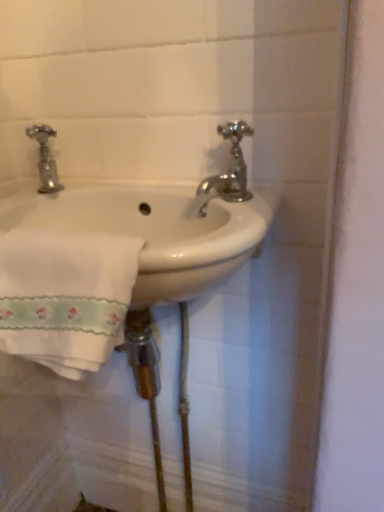
Identify the location of white embroidered towel at lower left. tap(65, 297).

What is the approximate height of white ceramic sink at center?

It is 14.19 centimeters.

Image resolution: width=384 pixels, height=512 pixels. Find the location of `polished chrome faucet at upper right`. polished chrome faucet at upper right is located at coordinates (231, 167).

Between polished chrome faucet at upper right and white embroidered towel at lower left, which one has smaller size?

polished chrome faucet at upper right is smaller.

Measure the distance from polished chrome faucet at upper right to white embroidered towel at lower left.

polished chrome faucet at upper right and white embroidered towel at lower left are 10.01 inches apart from each other.

Can you confirm if polished chrome faucet at upper right is thinner than white embroidered towel at lower left?

Indeed, polished chrome faucet at upper right has a lesser width compared to white embroidered towel at lower left.

The image size is (384, 512). I want to click on tap behind the white embroidered towel at lower left, so click(231, 167).

Which of these two, white embroidered towel at lower left or polished chrome faucet at upper right, is thinner?

polished chrome faucet at upper right is thinner.

Is polished chrome faucet at upper right located within white embroidered towel at lower left?

No, polished chrome faucet at upper right is located outside of white embroidered towel at lower left.

Based on the photo, are white embroidered towel at lower left and polished chrome faucet at upper right making contact?

No, white embroidered towel at lower left is not touching polished chrome faucet at upper right.

Is white embroidered towel at lower left to the right of polished chrome faucet at upper right from the viewer's perspective?

No, white embroidered towel at lower left is not to the right of polished chrome faucet at upper right.

Is polished chrome faucet at upper right far away from white ceramic sink at center?

polished chrome faucet at upper right is near white ceramic sink at center, not far away.

From the image's perspective, which one is positioned higher, polished chrome faucet at upper right or white ceramic sink at center?

polished chrome faucet at upper right.

Is polished chrome faucet at upper right closer to the viewer compared to white ceramic sink at center?

No, it is not.

Is white ceramic sink at center a part of polished chrome faucet at upper right?

No.

Is white embroidered towel at lower left thinner than white ceramic sink at center?

Correct, the width of white embroidered towel at lower left is less than that of white ceramic sink at center.

Would you say white embroidered towel at lower left is a long distance from white ceramic sink at center?

No.

Between point (79, 337) and point (133, 189), which one is positioned behind?

Positioned behind is point (133, 189).

Is point (159, 186) more distant than point (131, 243)?

Yes, point (159, 186) is behind point (131, 243).

Would you consider white ceramic sink at center to be distant from white embroidered towel at lower left?

No, white ceramic sink at center is not far from white embroidered towel at lower left.

How different are the orientations of white ceramic sink at center and white embroidered towel at lower left in degrees?

0.000157 degrees.

Which object is further away from the camera taking this photo, white ceramic sink at center or white embroidered towel at lower left?

white ceramic sink at center is further away from the camera.

Can you see white ceramic sink at center touching polished chrome faucet at upper right?

No, white ceramic sink at center is not next to polished chrome faucet at upper right.

Is white ceramic sink at center positioned before polished chrome faucet at upper right?

Yes, it is.

This screenshot has width=384, height=512. In order to click on tap above the white ceramic sink at center (from the image's perspective) in this screenshot , I will do `click(231, 167)`.

How far apart are white ceramic sink at center and polished chrome faucet at upper right?

They are 4.23 inches apart.

You are a GUI agent. You are given a task and a screenshot of the screen. Output one action in this format:
    pyautogui.click(x=<x>, y=<y>)
    Task: Click on the bath towel in front of the polished chrome faucet at upper right
    This screenshot has height=512, width=384.
    Given the screenshot: What is the action you would take?
    pyautogui.click(x=65, y=297)

Image resolution: width=384 pixels, height=512 pixels. There is a white embroidered towel at lower left. In order to click on tap above it (from a real-world perspective) in this screenshot , I will do `click(231, 167)`.

When comparing their distances from white embroidered towel at lower left, does white ceramic sink at center or polished chrome faucet at upper right seem closer?

white ceramic sink at center lies closer to white embroidered towel at lower left than the other object.

Which object lies nearer to the anchor point white ceramic sink at center, polished chrome faucet at upper right or white embroidered towel at lower left?

polished chrome faucet at upper right.

Based on their spatial positions, is white ceramic sink at center or white embroidered towel at lower left closer to polished chrome faucet at upper right?

Among the two, white ceramic sink at center is located nearer to polished chrome faucet at upper right.

Looking at the image, which one is located closer to polished chrome faucet at upper right, white embroidered towel at lower left or white ceramic sink at center?

Among the two, white ceramic sink at center is located nearer to polished chrome faucet at upper right.

Estimate the real-world distances between objects in this image. Which object is closer to white ceramic sink at center, white embroidered towel at lower left or polished chrome faucet at upper right?

Among the two, polished chrome faucet at upper right is located nearer to white ceramic sink at center.

In the scene shown: Estimate the real-world distances between objects in this image. Which object is further from white embroidered towel at lower left, polished chrome faucet at upper right or white ceramic sink at center?

polished chrome faucet at upper right is positioned further to the anchor white embroidered towel at lower left.

The image size is (384, 512). I want to click on sink situated between white embroidered towel at lower left and polished chrome faucet at upper right from left to right, so click(164, 225).